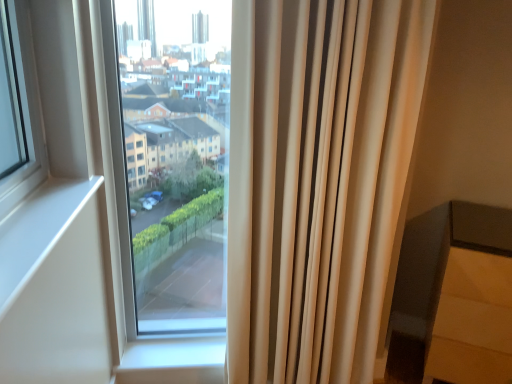
Question: From their relative heights in the image, would you say matte gray chair at lower right is taller or shorter than beige fabric curtain at right?

Choices:
 (A) tall
 (B) short

Answer: (B)

Question: From the image's perspective, is matte gray chair at lower right positioned above or below beige fabric curtain at right?

Choices:
 (A) above
 (B) below

Answer: (B)

Question: Which is farther from the matte gray chair at lower right?

Choices:
 (A) beige fabric curtain at right
 (B) transparent glass window at center

Answer: (B)

Question: Which of these objects is positioned closest to the beige fabric curtain at right?

Choices:
 (A) transparent glass window at center
 (B) matte gray chair at lower right

Answer: (B)